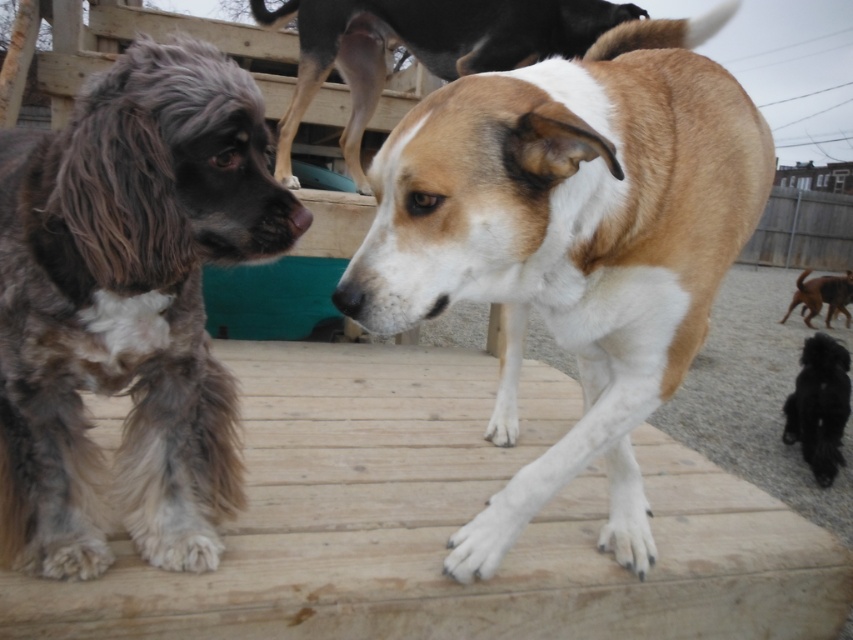
You are standing on the wooden deck and want to throw a ball to a spot closer to you. Which point should you aim for, point (186, 550) or point (828, 416)?

Point (186, 550) is closer to the camera, so you should aim for point (186, 550) to throw the ball to a spot closer to you.